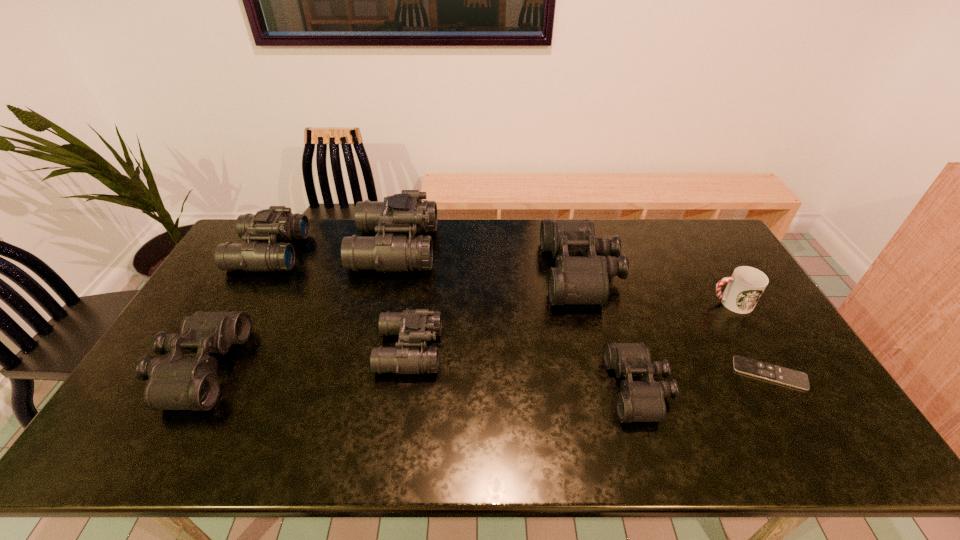
I want to click on vacant space that satisfies the following two spatial constraints: 1. through the lenses of the tallest object; 2. on the side of the red cup where the handle is located, so click(382, 303).

Where is `vacant space that satisfies the following two spatial constraints: 1. through the lenses of the smallest blue binoculars; 2. on the left side of the shortest object`? vacant space that satisfies the following two spatial constraints: 1. through the lenses of the smallest blue binoculars; 2. on the left side of the shortest object is located at coordinates (406, 373).

I want to click on vacant space that satisfies the following two spatial constraints: 1. on the back side of the remote control; 2. at the eyepieces of the farthest black binoculars, so click(x=710, y=273).

Find the location of a particular element. This screenshot has width=960, height=540. vacant region that satisfies the following two spatial constraints: 1. through the lenses of the tallest binoculars; 2. on the left side of the shortest object is located at coordinates (366, 373).

I want to click on free location that satisfies the following two spatial constraints: 1. at the eyepieces of the farthest black binoculars; 2. on the left side of the remote control, so click(x=607, y=373).

Where is `free location that satisfies the following two spatial constraints: 1. at the eyepieces of the biggest black binoculars; 2. on the back side of the shortest object`? free location that satisfies the following two spatial constraints: 1. at the eyepieces of the biggest black binoculars; 2. on the back side of the shortest object is located at coordinates (607, 373).

The height and width of the screenshot is (540, 960). I want to click on blank space that satisfies the following two spatial constraints: 1. at the eyepieces of the farthest black binoculars; 2. on the side of the cup where the handle is located, so click(x=588, y=303).